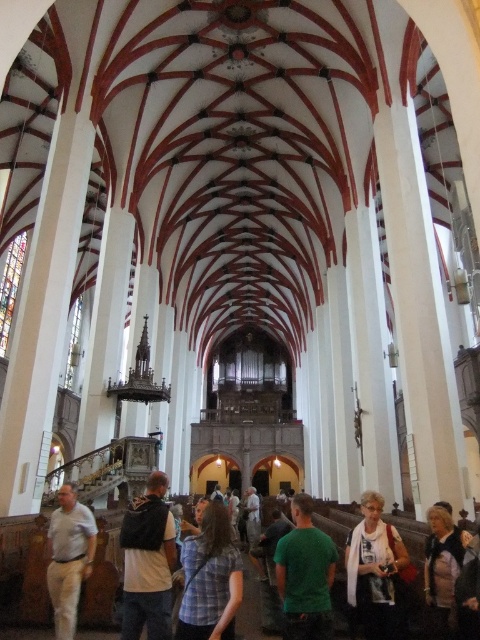
Which is above, plaid shirt at center or white cotton shirt at lower right?

Positioned higher is plaid shirt at center.

Can you confirm if plaid shirt at center is positioned to the left of white cotton shirt at lower right?

Yes, plaid shirt at center is to the left of white cotton shirt at lower right.

Which is in front, point (210, 547) or point (356, 570)?

Point (210, 547) is more forward.

I want to click on plaid shirt at center, so click(210, 579).

Based on the photo, is plaid shirt at center positioned behind light brown leather jacket at lower right?

No, plaid shirt at center is in front of light brown leather jacket at lower right.

This screenshot has width=480, height=640. I want to click on plaid shirt at center, so click(210, 579).

Looking at this image, who is more forward, (206, 582) or (456, 564)?

Point (206, 582) is in front.

This screenshot has width=480, height=640. What are the coordinates of `plaid shirt at center` in the screenshot? It's located at (210, 579).

In the scene shown: Which is more to the left, white cotton shirt at center or green matte shirt at center?

From the viewer's perspective, white cotton shirt at center appears more on the left side.

Is point (167, 632) behind point (309, 516)?

No, (167, 632) is closer to viewer.

Does point (141, 522) come farther from viewer compared to point (311, 620)?

Yes, point (141, 522) is behind point (311, 620).

This screenshot has height=640, width=480. What are the coordinates of `white cotton shirt at center` in the screenshot? It's located at (147, 563).